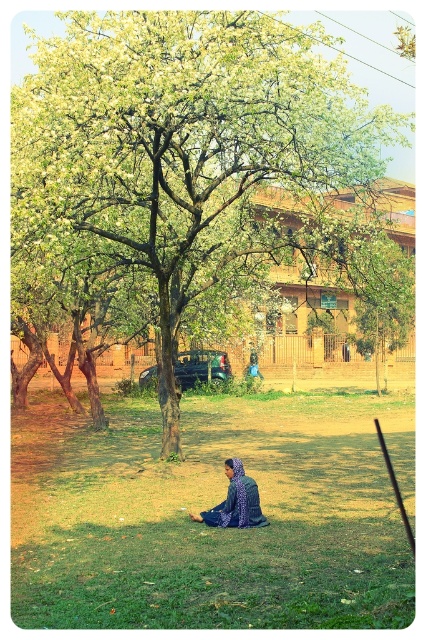
Where is `green leafy tree at center`? Image resolution: width=426 pixels, height=640 pixels. green leafy tree at center is located at coordinates (189, 145).

Is green leafy tree at center closer to the viewer compared to blue patterned dress at center?

No, it is behind blue patterned dress at center.

Is point (218, 138) farther from viewer compared to point (221, 509)?

Yes, it is.

Identify the location of green leafy tree at center. The height and width of the screenshot is (640, 426). (189, 145).